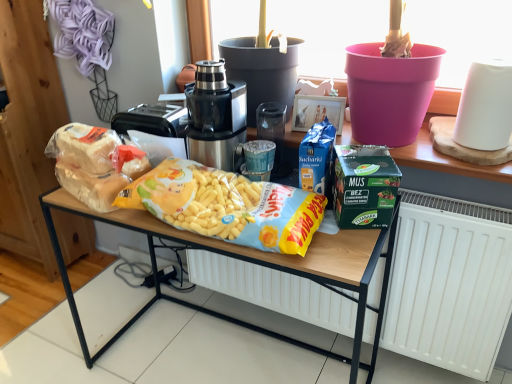
Question: In terms of height, does translucent plastic bag of bread at left, which ranks as the first cereal in left-to-right order, look taller or shorter compared to white matte radiator at lower center?

Choices:
 (A) tall
 (B) short

Answer: (B)

Question: Does point (83, 198) appear closer or farther from the camera than point (467, 375)?

Choices:
 (A) farther
 (B) closer

Answer: (B)

Question: Considering the real-world distances, which object is closest to the green matte lunch box at center?

Choices:
 (A) satin black juicer at center
 (B) translucent plastic bag of bread at left, which ranks as the first cereal in left-to-right order
 (C) yellow matte corn at center, which ranks as the first cereal in right-to-left order
 (D) yellow matte corn sticks at center
 (E) white matte radiator at lower center

Answer: (C)

Question: Which object is positioned farthest from the translucent plastic bag of bread at left, which is the 2th cereal from right to left?

Choices:
 (A) white matte radiator at lower center
 (B) satin black juicer at center
 (C) yellow matte corn at center, which appears as the 2th cereal when viewed from the left
 (D) green matte lunch box at center
 (E) yellow matte corn sticks at center

Answer: (A)